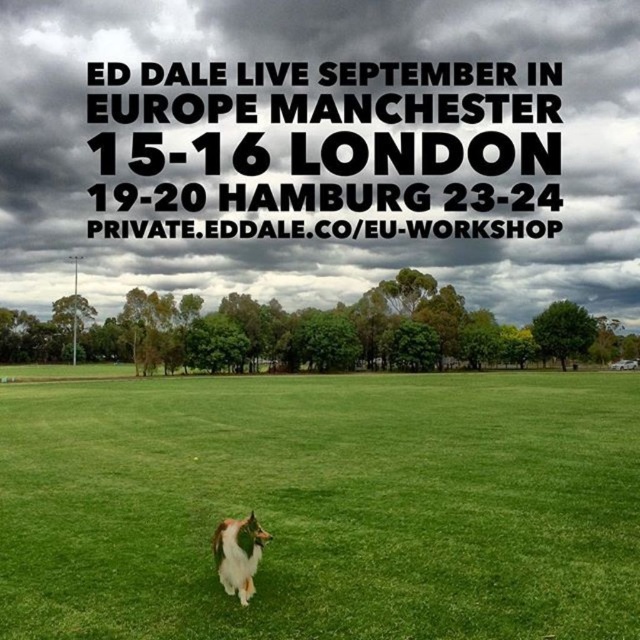
Is green grass at center to the right of white fluffy dog at lower center from the viewer's perspective?

Yes, green grass at center is to the right of white fluffy dog at lower center.

Is point (273, 422) more distant than point (236, 586)?

Yes, it is.

Where is `green grass at center`? green grass at center is located at coordinates (323, 506).